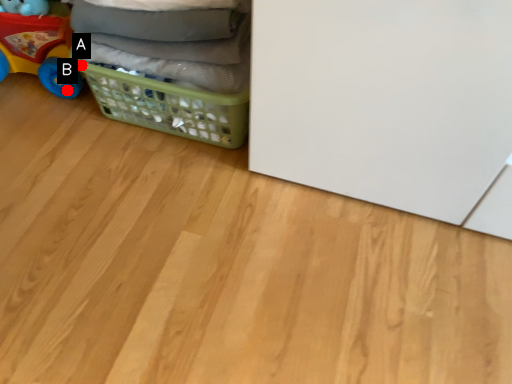
Question: Two points are circled on the image, labeled by A and B beside each circle. Which of the following is the farthest from the observer?

Choices:
 (A) A is further
 (B) B is further

Answer: (B)